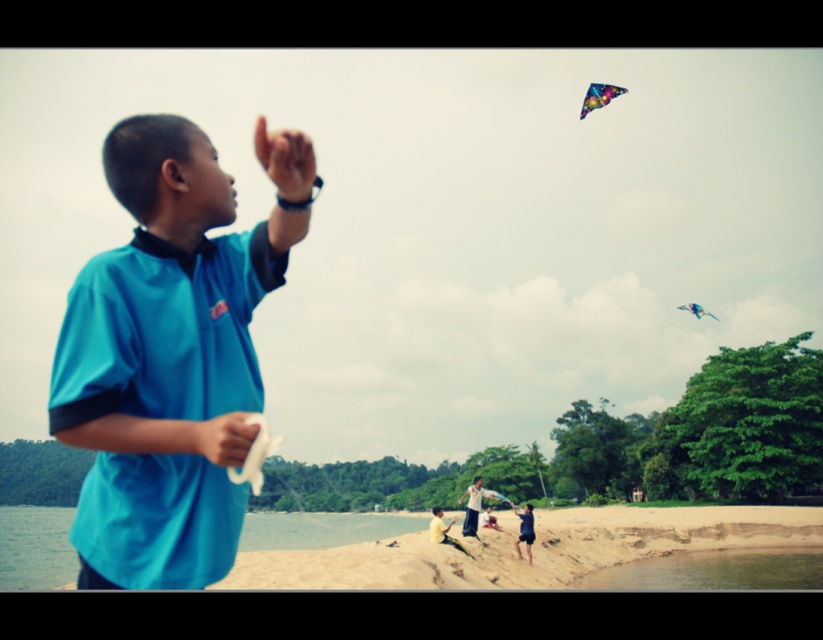
Between multicolored paper kite at upper right and dark blue fabric pants at lower center, which one has less height?

dark blue fabric pants at lower center is shorter.

From the picture: Does multicolored paper kite at upper right have a greater width compared to dark blue fabric pants at lower center?

Indeed, multicolored paper kite at upper right has a greater width compared to dark blue fabric pants at lower center.

Find the location of `multicolored paper kite at upper right`. multicolored paper kite at upper right is located at coordinates (x=598, y=97).

Between point (754, 557) and point (695, 314), which one is positioned behind?

The point (695, 314) is more distant.

Does clear water at lower right appear over translucent blue kite at upper right?

No.

Who is more forward, (715, 584) or (679, 307)?

Point (715, 584) is in front.

The height and width of the screenshot is (640, 823). Identify the location of clear water at lower right. (714, 570).

Which is more to the right, teal matte shirt at center or dark blue fabric pants at lower center?

dark blue fabric pants at lower center

Between point (123, 538) and point (519, 516), which one is positioned behind?

The point (519, 516) is behind.

The width and height of the screenshot is (823, 640). What do you see at coordinates (170, 355) in the screenshot?
I see `teal matte shirt at center` at bounding box center [170, 355].

You are a GUI agent. You are given a task and a screenshot of the screen. Output one action in this format:
    pyautogui.click(x=<x>, y=<y>)
    Task: Click on the teal matte shirt at center
    The image size is (823, 640).
    Given the screenshot: What is the action you would take?
    pyautogui.click(x=170, y=355)